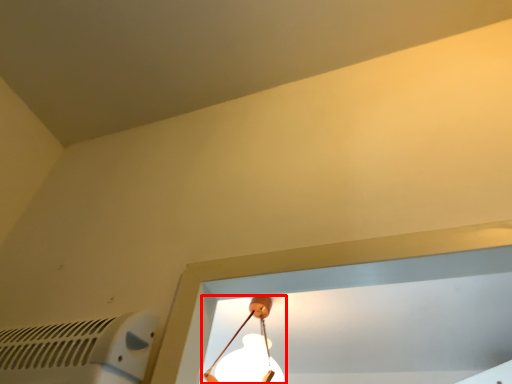
Question: From the image's perspective, considering the relative positions of lamp (annotated by the red box) and air conditioning in the image provided, where is lamp (annotated by the red box) located with respect to the staircase?

Choices:
 (A) above
 (B) below

Answer: (B)